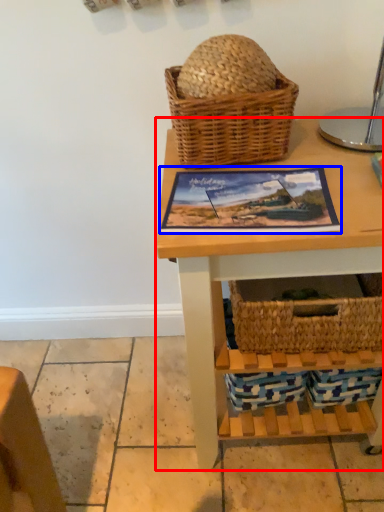
Question: Which object is closer to the camera taking this photo, table (highlighted by a red box) or picture frame (highlighted by a blue box)?

Choices:
 (A) table
 (B) picture frame

Answer: (A)